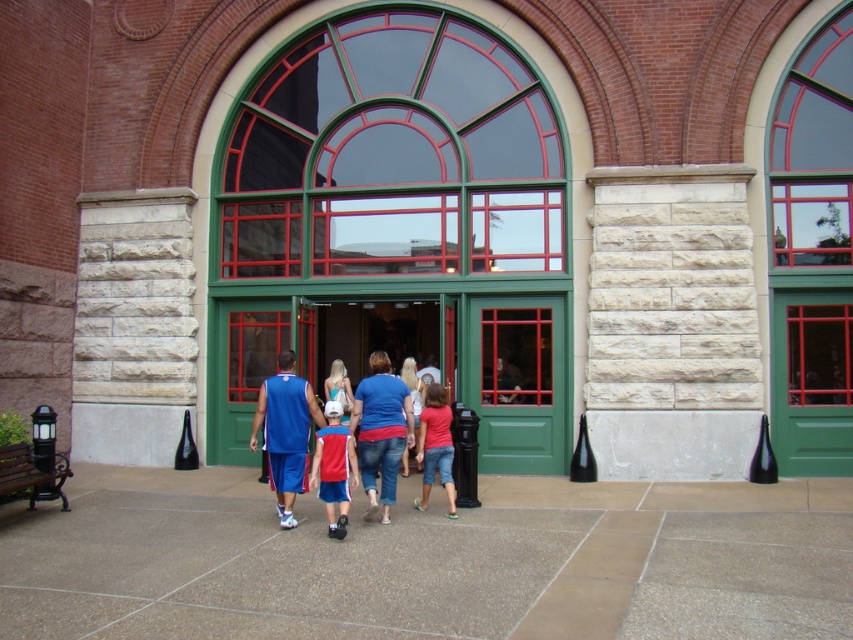
Who is positioned more to the right, matte red shirt at center or teal fabric dress at center?

From the viewer's perspective, matte red shirt at center appears more on the right side.

Where is `matte red shirt at center`? This screenshot has width=853, height=640. matte red shirt at center is located at coordinates (434, 445).

Find the location of a particular element. The width and height of the screenshot is (853, 640). matte red shirt at center is located at coordinates (434, 445).

Can you confirm if blue jersey at center is positioned above red fabric shirt at center?

Yes, blue jersey at center is above red fabric shirt at center.

Is point (322, 417) positioned behind point (318, 465)?

Yes, point (322, 417) is behind point (318, 465).

Locate an element on the screen. This screenshot has width=853, height=640. blue jersey at center is located at coordinates (285, 433).

Consider the image. Between red fabric shirt at center and blue fabric shirt at center, which one is positioned lower?

red fabric shirt at center is lower down.

Does point (340, 467) come farther from viewer compared to point (500, 403)?

No, (340, 467) is in front of (500, 403).

The width and height of the screenshot is (853, 640). What do you see at coordinates (334, 468) in the screenshot?
I see `red fabric shirt at center` at bounding box center [334, 468].

I want to click on red fabric shirt at center, so click(x=334, y=468).